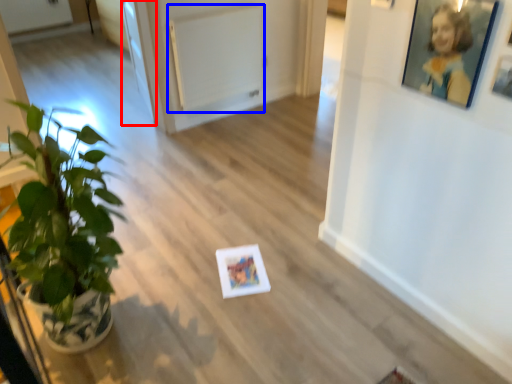
Question: Which object is closer to the camera taking this photo, glass door (highlighted by a red box) or radiator (highlighted by a blue box)?

Choices:
 (A) glass door
 (B) radiator

Answer: (B)